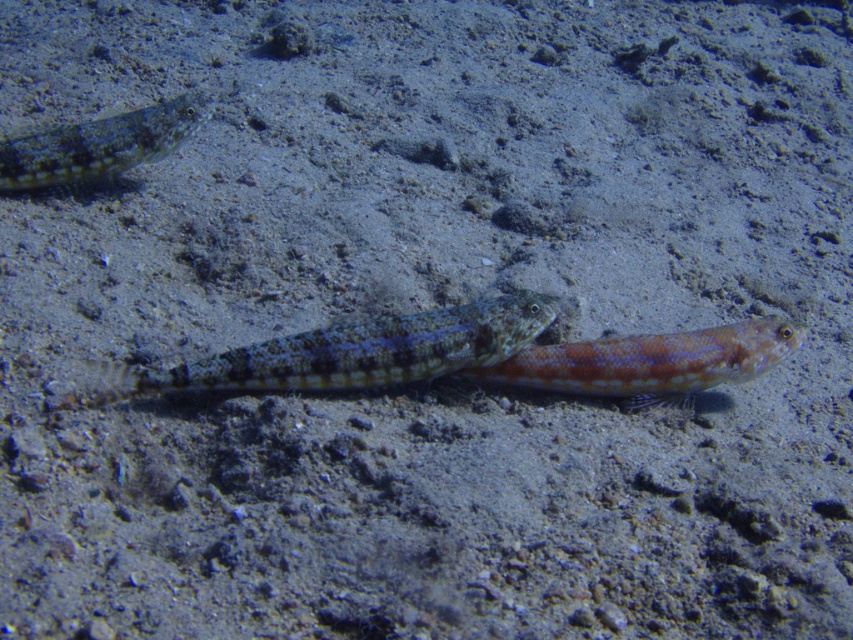
Question: Which object is the closest to the speckled sand eel at center?

Choices:
 (A) speckled skin fish at upper left
 (B) shiny orange fish at center

Answer: (B)

Question: Is speckled sand eel at center to the left of shiny orange fish at center from the viewer's perspective?

Choices:
 (A) yes
 (B) no

Answer: (A)

Question: Can you confirm if speckled sand eel at center is positioned below shiny orange fish at center?

Choices:
 (A) no
 (B) yes

Answer: (A)

Question: Is speckled sand eel at center smaller than speckled skin fish at upper left?

Choices:
 (A) yes
 (B) no

Answer: (A)

Question: Which of the following is the closest to the observer?

Choices:
 (A) shiny orange fish at center
 (B) speckled skin fish at upper left
 (C) speckled sand eel at center

Answer: (C)

Question: Which of the following is the farthest from the observer?

Choices:
 (A) (585, 352)
 (B) (49, 164)
 (C) (460, 336)

Answer: (B)